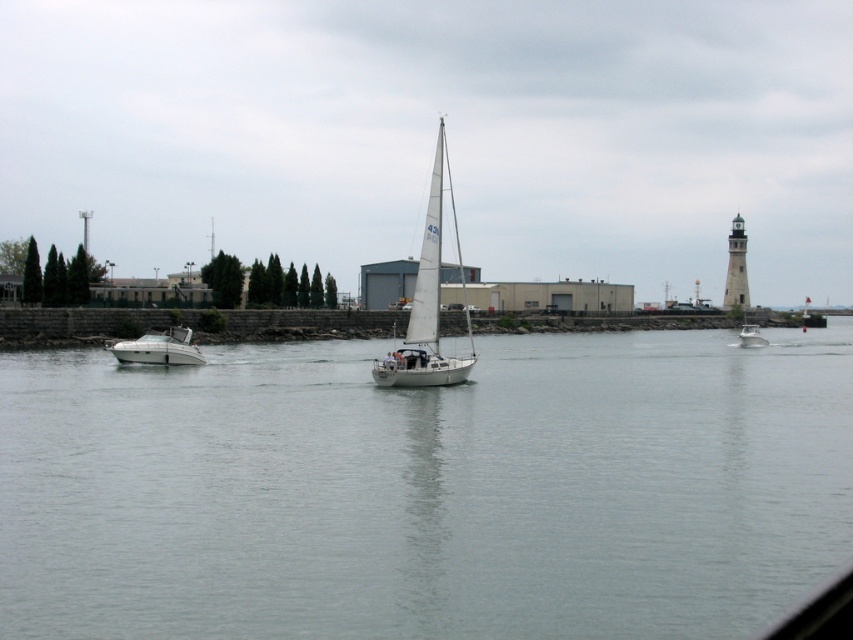
You are a photographer standing on the dock and want to take a photo of the white stone lighthouse at right and the white glossy boat at right. Which object will appear larger in the photo?

The white stone lighthouse at right will appear larger in the photo because it is closer to the photographer than the white glossy boat at right.

You are standing at the waterfront and want to reach a specific point in the water that is 163.30 meters away from you. The point is marked as point [744,280]. Can you estimate how far you need to walk along the shore to reach this point?

The point [744,280] is 163.30 meters from the viewer, so you need to walk approximately 163.30 meters along the shore to reach it.

You are standing at the point with coordinates point (x=729, y=262) and want to see if you can see the point (x=136, y=362) without any obstructions. Based on the scene description, can you see it?

Yes, because point (x=136, y=362) is in front of point (x=729, y=262), so it would be visible from that position.